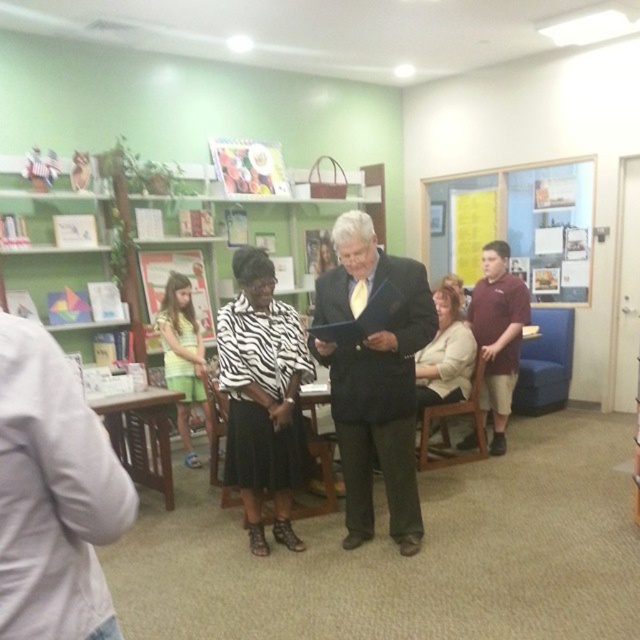
Is zebra print blouse at center above yellow paper at upper center?

Incorrect, zebra print blouse at center is not positioned above yellow paper at upper center.

Which is behind, point (305, 547) or point (460, 212)?

Point (460, 212)

Identify the location of zebra print blouse at center. This screenshot has width=640, height=640. (262, 396).

Is black suit at center below yellow-green shorts at left?

Correct, black suit at center is located below yellow-green shorts at left.

Is point (403, 432) closer to camera compared to point (179, 305)?

Yes.

Where is `black suit at center`? black suit at center is located at coordinates (374, 378).

Consider the image. Does yellow paper at upper center appear on the right side of yellow-green shorts at left?

Correct, you'll find yellow paper at upper center to the right of yellow-green shorts at left.

Who is more distant from viewer, (440, 230) or (166, 337)?

Positioned behind is point (440, 230).

Where is `yellow paper at upper center`? This screenshot has height=640, width=640. yellow paper at upper center is located at coordinates (516, 225).